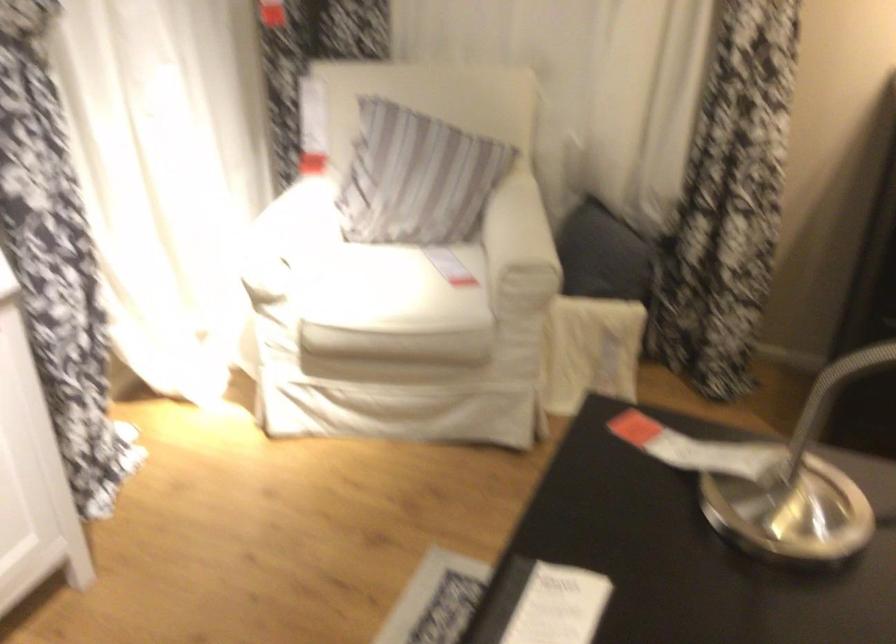
Locate an element on the screen. This screenshot has width=896, height=644. white chair armrest is located at coordinates (509, 228).